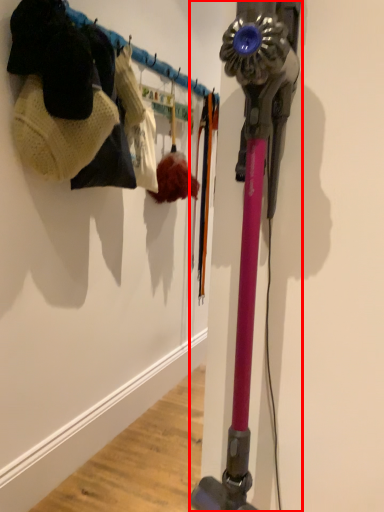
Question: From the image's perspective, what is the correct spatial positioning of vacuum (annotated by the red box) in reference to clothing?

Choices:
 (A) below
 (B) above

Answer: (A)